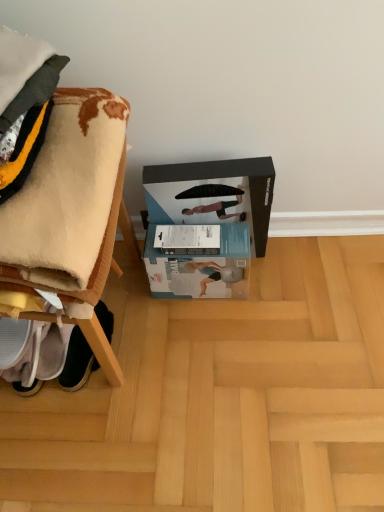
Locate an element on the screen. free space above white cardboard box at center (from a real-world perspective) is located at coordinates (201, 242).